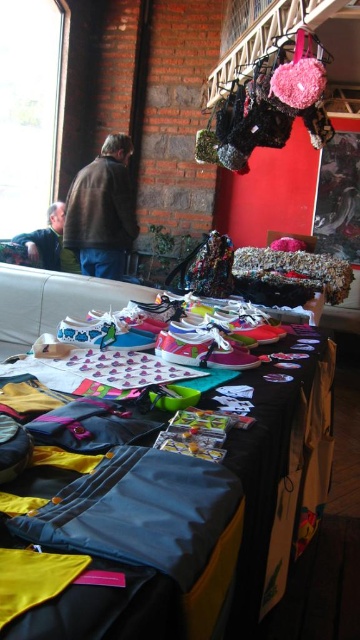
Question: Among these points, which one is farthest from the camera?

Choices:
 (A) (127, 621)
 (B) (51, 205)
 (C) (119, 276)

Answer: (B)

Question: Which of the following is the farthest from the observer?

Choices:
 (A) (78, 193)
 (B) (288, 406)

Answer: (A)

Question: Among these objects, which one is nearest to the camera?

Choices:
 (A) gray fabric jacket at left
 (B) shiny fabric bags at center

Answer: (B)

Question: Is shiny fabric bags at center behind brown leather jacket at center?

Choices:
 (A) no
 (B) yes

Answer: (A)

Question: Can you confirm if brown leather jacket at center is positioned to the right of gray fabric jacket at left?

Choices:
 (A) yes
 (B) no

Answer: (A)

Question: Considering the relative positions of shiny fabric bags at center and gray fabric jacket at left in the image provided, where is shiny fabric bags at center located with respect to gray fabric jacket at left?

Choices:
 (A) right
 (B) left

Answer: (A)